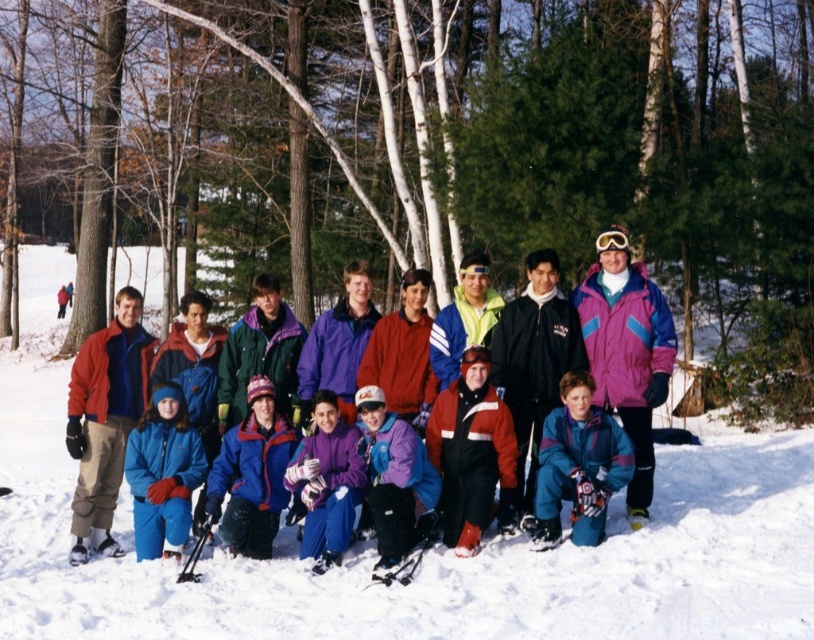
Question: Which point appears farthest from the camera in this image?

Choices:
 (A) (611, 300)
 (B) (169, 417)
 (C) (742, 508)
 (D) (90, 362)

Answer: (D)

Question: Considering the real-world distances, which object is closest to the blue fleece jacket at lower left?

Choices:
 (A) white fluffy snow at center
 (B) matte black goggles at upper center

Answer: (A)

Question: Which object is farther from the camera taking this photo?

Choices:
 (A) matte purple ski jacket at center
 (B) blue fleece jacket at lower left
 (C) matte red jacket at center

Answer: (C)

Question: Can you confirm if matte red jacket at center is positioned to the right of blue fleece jacket at lower left?

Choices:
 (A) no
 (B) yes

Answer: (A)

Question: Is white fluffy snow at center to the left of matte purple ski jacket at center from the viewer's perspective?

Choices:
 (A) no
 (B) yes

Answer: (B)

Question: Is blue fleece jacket at lower left positioned at the back of matte black goggles at upper center?

Choices:
 (A) yes
 (B) no

Answer: (B)